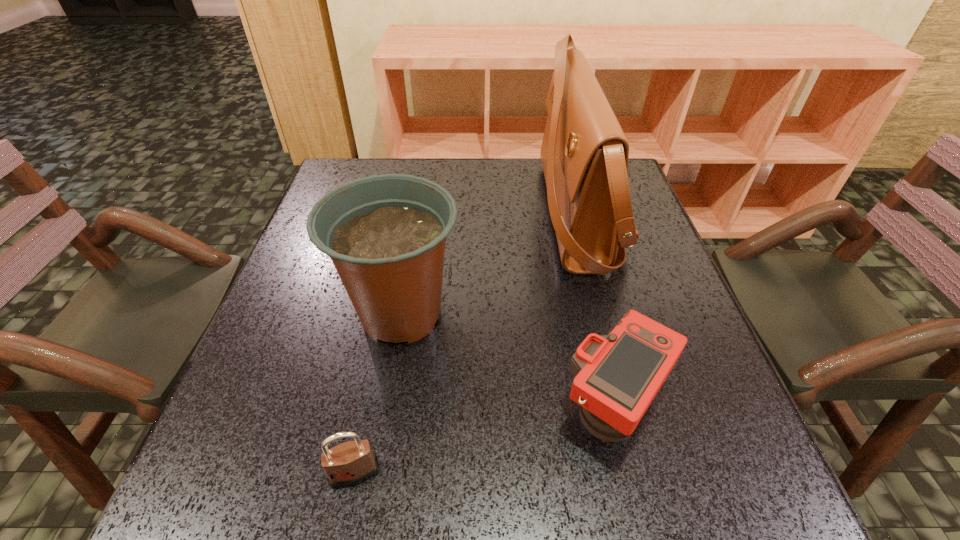
In order to click on vacant area that lies between the flowerpot and the tallest object in this screenshot , I will do `click(489, 264)`.

You are a GUI agent. You are given a task and a screenshot of the screen. Output one action in this format:
    pyautogui.click(x=<x>, y=<y>)
    Task: Click on the vacant region between the shortest object and the camera
    This screenshot has width=960, height=540.
    Given the screenshot: What is the action you would take?
    pyautogui.click(x=485, y=440)

Where is `free space that is in between the tallest object and the third shortest object`? free space that is in between the tallest object and the third shortest object is located at coordinates (489, 264).

Image resolution: width=960 pixels, height=540 pixels. Identify the location of vacant area that lies between the camera and the shortest object. (485, 440).

I want to click on the closest object to the shortest object, so click(x=385, y=234).

At what (x,y) coordinates should I click in order to perform the action: click on object that is the second closest to the satchel. Please return your answer as a coordinate pair (x, y). This screenshot has width=960, height=540. Looking at the image, I should click on (385, 234).

I want to click on free space that satisfies the following two spatial constraints: 1. on the back side of the flowerpot; 2. on the right side of the shortest object, so click(387, 314).

Find the location of a particular element. The height and width of the screenshot is (540, 960). free location that satisfies the following two spatial constraints: 1. on the front flap of the satchel; 2. on the front side of the third tallest object is located at coordinates (627, 407).

Locate an element on the screen. This screenshot has width=960, height=540. vacant space that satisfies the following two spatial constraints: 1. on the front side of the flowerpot; 2. on the left side of the camera is located at coordinates (386, 407).

Where is `free location that satisfies the following two spatial constraints: 1. on the front flap of the satchel; 2. on the front side of the camera`? This screenshot has width=960, height=540. free location that satisfies the following two spatial constraints: 1. on the front flap of the satchel; 2. on the front side of the camera is located at coordinates (627, 407).